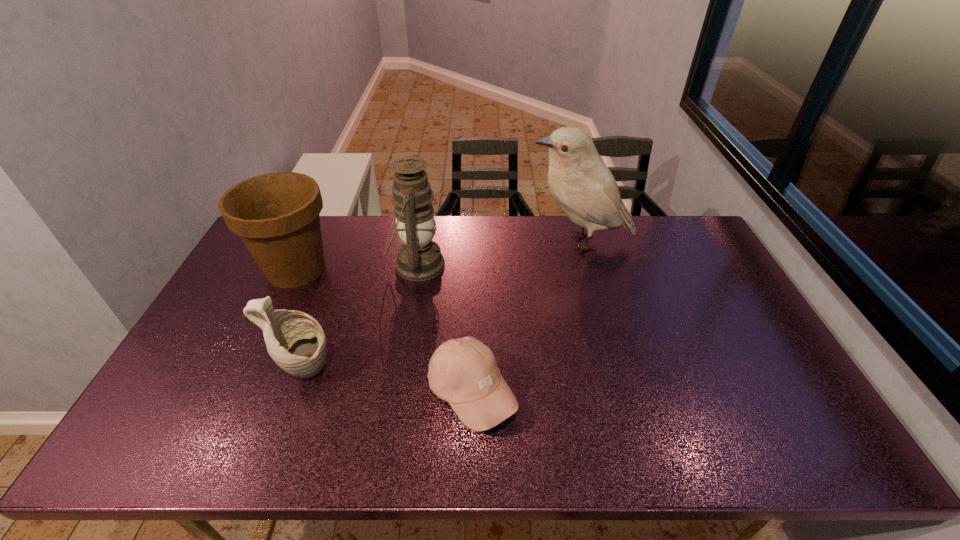
The width and height of the screenshot is (960, 540). I want to click on vacant point at the left edge, so click(x=260, y=274).

The image size is (960, 540). In the image, there is a desktop. Find the location of `vacant space at the right edge`. vacant space at the right edge is located at coordinates (746, 358).

Image resolution: width=960 pixels, height=540 pixels. Find the location of `vacant point located between the parakeet and the oil lamp`. vacant point located between the parakeet and the oil lamp is located at coordinates (x=498, y=254).

The width and height of the screenshot is (960, 540). In order to click on free point between the parakeet and the pitcher in this screenshot , I will do `click(443, 307)`.

Locate an element on the screen. blank region between the pitcher and the oil lamp is located at coordinates (361, 318).

At what (x,y) coordinates should I click in order to perform the action: click on vacant region between the baseball cap and the flowerpot. Please return your answer as a coordinate pair (x, y). The image size is (960, 540). Looking at the image, I should click on (384, 331).

In order to click on free space between the baseball cap and the flowerpot in this screenshot , I will do pos(384,331).

Identify the location of empty space between the parakeet and the baseball cap. Image resolution: width=960 pixels, height=540 pixels. [x=526, y=318].

Where is `vacant space that is in between the oil lamp and the baseball cap`? vacant space that is in between the oil lamp and the baseball cap is located at coordinates (444, 329).

Find the location of a particular element. This screenshot has height=540, width=960. free space between the pitcher and the shortest object is located at coordinates (389, 382).